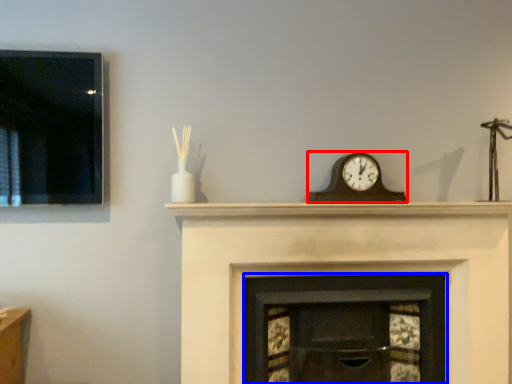
Question: Among these objects, which one is farthest to the camera, wall clock (highlighted by a red box) or fireplace (highlighted by a blue box)?

Choices:
 (A) wall clock
 (B) fireplace

Answer: (A)